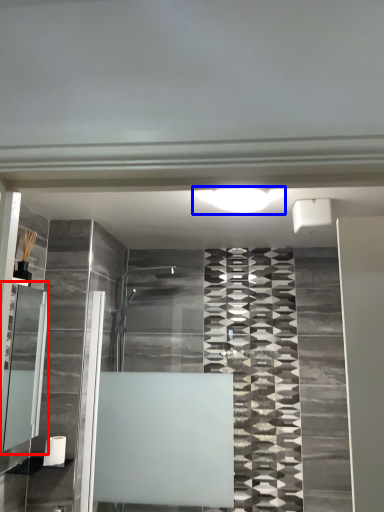
Question: Which of the following is the closest to the observer, cabinet (highlighted by a red box) or light (highlighted by a blue box)?

Choices:
 (A) cabinet
 (B) light

Answer: (A)